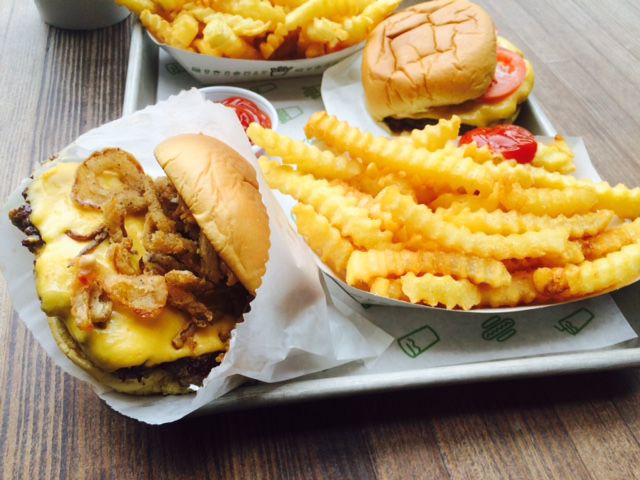
Where is `tray liner`? The image size is (640, 480). tray liner is located at coordinates (420, 350).